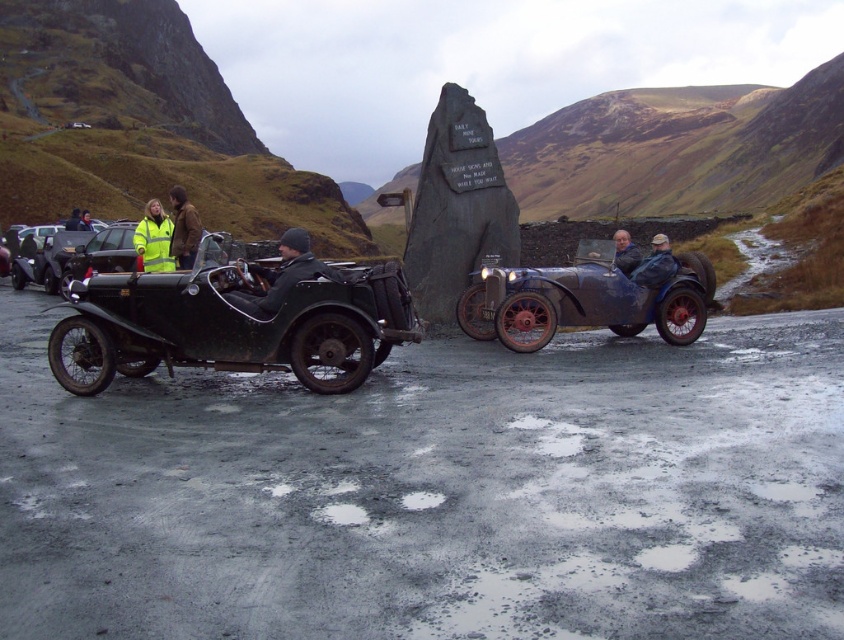
Question: Which point is farther to the camera?

Choices:
 (A) (314, 289)
 (B) (652, 257)

Answer: (B)

Question: Which object is the closest to the reflective yellow jacket at center?

Choices:
 (A) gray fabric jacket at center
 (B) shiny blue metal sidecar at center

Answer: (B)

Question: Does shiny blue metal sidecar at center appear on the right side of reflective yellow jacket at left?

Choices:
 (A) no
 (B) yes

Answer: (B)

Question: Among these points, which one is nearest to the camera?

Choices:
 (A) (161, 243)
 (B) (192, 257)
 (C) (626, 232)
 (D) (30, 273)

Answer: (B)

Question: Is shiny black car at left in front of yellow reflective jacket at left?

Choices:
 (A) no
 (B) yes

Answer: (A)

Question: Is dark gray stone monument at center wider than brown leather jacket at center?

Choices:
 (A) yes
 (B) no

Answer: (B)